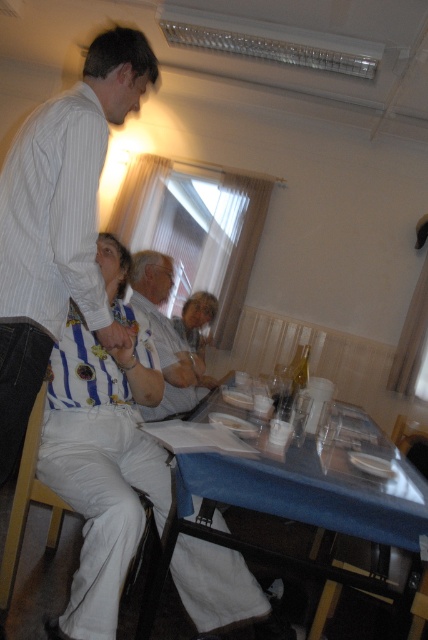
Question: Is light gray shirt at center bigger than wooden at lower right?

Choices:
 (A) no
 (B) yes

Answer: (B)

Question: Can you confirm if white fabric chair at lower left is positioned to the left of matte white hair at center?

Choices:
 (A) yes
 (B) no

Answer: (A)

Question: Estimate the real-world distances between objects in this image. Which object is closer to the white striped shirt at upper left?

Choices:
 (A) matte white hair at center
 (B) blue fabric table at lower center

Answer: (B)

Question: Which object is the farthest from the wooden at lower right?

Choices:
 (A) striped fabric shirt at center
 (B) blue fabric table at lower center

Answer: (A)

Question: Which object is farther from the camera taking this photo?

Choices:
 (A) light gray shirt at center
 (B) white fabric chair at lower left

Answer: (A)

Question: Can you confirm if blue fabric table at lower center is positioned below matte white hair at center?

Choices:
 (A) no
 (B) yes

Answer: (B)